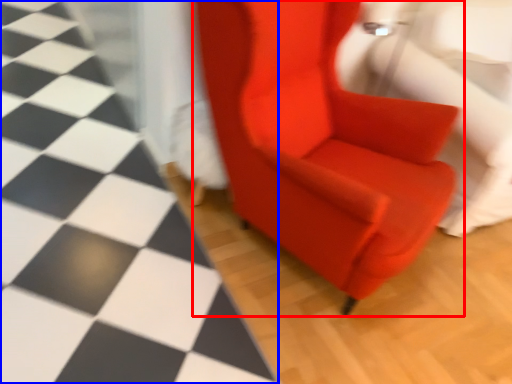
Question: Among these objects, which one is farthest to the camera, chair (highlighted by a red box) or tile (highlighted by a blue box)?

Choices:
 (A) chair
 (B) tile

Answer: (A)